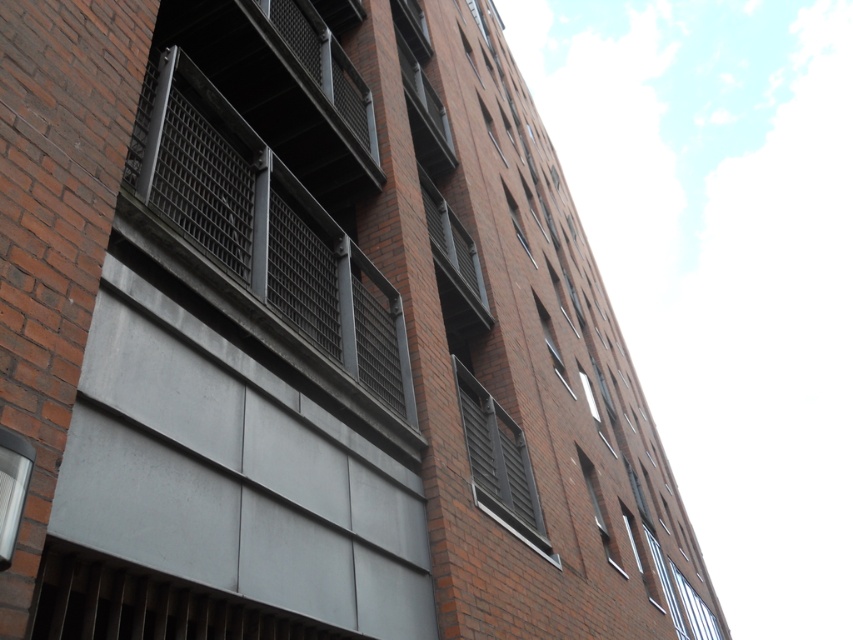
Question: Does clear glass window at lower left appear over clear glass window at lower right?

Choices:
 (A) no
 (B) yes

Answer: (B)

Question: Does clear glass window at lower left have a lesser width compared to clear glass window at lower right?

Choices:
 (A) yes
 (B) no

Answer: (A)

Question: Based on their relative distances, which object is farther from the clear glass window at lower left?

Choices:
 (A) clear glass window at lower right
 (B) matte gray window at center
 (C) metallic gray vent at center

Answer: (A)

Question: Among these points, which one is farthest from the camera?

Choices:
 (A) (514, 429)
 (B) (15, 506)
 (C) (698, 602)
 (D) (474, 307)

Answer: (C)

Question: Which of the following is the farthest from the observer?

Choices:
 (A) clear glass window at lower right
 (B) matte gray window at center
 (C) clear glass window at lower left
 (D) metallic gray vent at center

Answer: (A)

Question: Does matte gray window at center have a smaller size compared to clear glass window at lower right?

Choices:
 (A) no
 (B) yes

Answer: (B)